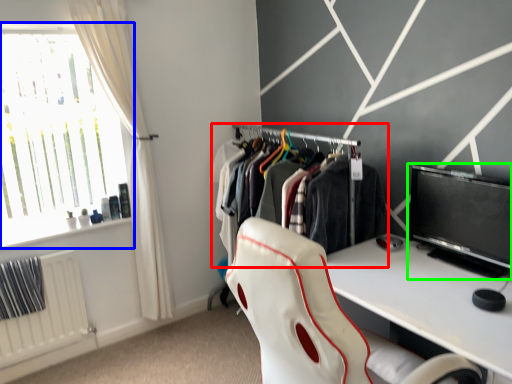
Question: Which object is the farthest from closet (highlighted by a red box)? Choose among these: window (highlighted by a blue box) or computer monitor (highlighted by a green box).

Choices:
 (A) window
 (B) computer monitor

Answer: (A)